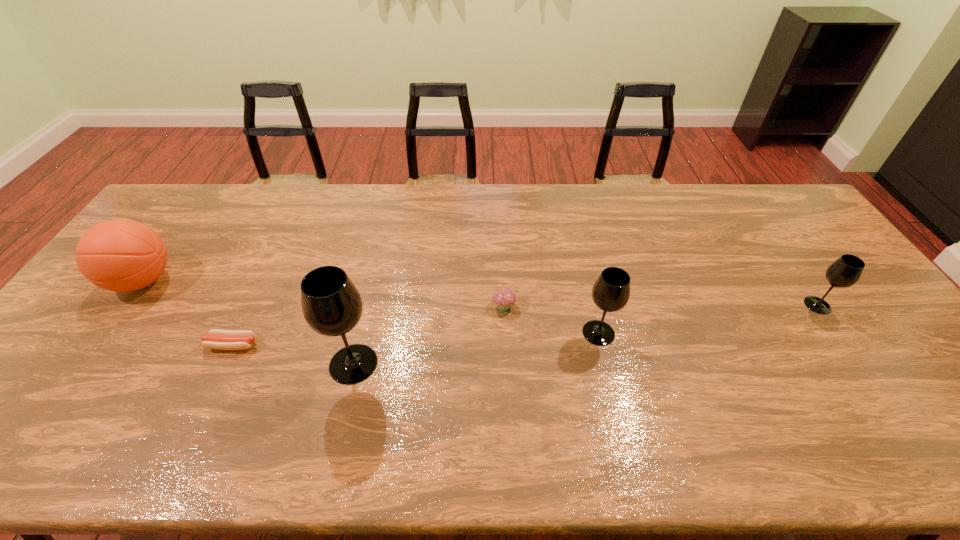
Find the location of a particular element. This screenshot has height=540, width=960. the leftmost object is located at coordinates (118, 255).

Locate an element on the screen. Image resolution: width=960 pixels, height=540 pixels. free space located 0.370m on the left of the tallest object is located at coordinates (180, 363).

This screenshot has width=960, height=540. Find the location of `free region located on the left of the second object from right to left`. free region located on the left of the second object from right to left is located at coordinates (540, 333).

In order to click on free spot located 0.260m on the back of the rightmost object in this screenshot , I will do `click(769, 236)`.

Where is `vacant space positioned on the back of the fourth object from left to right`? vacant space positioned on the back of the fourth object from left to right is located at coordinates (501, 243).

Where is `vacant space located on the left of the fifth object from right to left`? This screenshot has height=540, width=960. vacant space located on the left of the fifth object from right to left is located at coordinates (79, 345).

I want to click on vacant region located 0.320m on the right of the leftmost object, so click(285, 281).

I want to click on object at the near edge, so click(x=332, y=306).

You are a GUI agent. You are given a task and a screenshot of the screen. Output one action in this format:
    pyautogui.click(x=<x>, y=<y>)
    Task: Click on the object at the left edge
    Image resolution: width=960 pixels, height=540 pixels.
    Given the screenshot: What is the action you would take?
    pyautogui.click(x=118, y=255)

Locate an element on the screen. object located in the right edge section of the desktop is located at coordinates (844, 272).